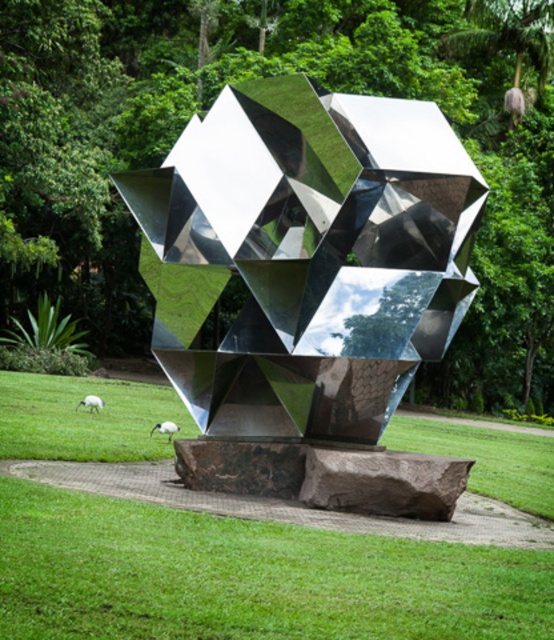
Is green grass at center wider than white fluffy sheep at lower left?

Indeed, green grass at center has a greater width compared to white fluffy sheep at lower left.

Does green grass at center appear on the left side of white fluffy sheep at lower left?

Incorrect, green grass at center is not on the left side of white fluffy sheep at lower left.

This screenshot has height=640, width=554. What do you see at coordinates (247, 577) in the screenshot?
I see `green grass at center` at bounding box center [247, 577].

I want to click on green grass at center, so click(247, 577).

This screenshot has width=554, height=640. I want to click on polished metallic sculpture at center, so click(310, 289).

Measure the distance from polished metallic sculpture at center to white feathered bird at lower left.

They are 20.27 feet apart.

The width and height of the screenshot is (554, 640). Identify the location of polished metallic sculpture at center. (310, 289).

The height and width of the screenshot is (640, 554). I want to click on polished metallic sculpture at center, so click(310, 289).

Can you confirm if green grass at center is positioned to the left of white feathered bird at lower left?

No, green grass at center is not to the left of white feathered bird at lower left.

Is point (166, 579) farther from viewer compared to point (94, 404)?

That is False.

This screenshot has width=554, height=640. I want to click on green grass at center, so click(247, 577).